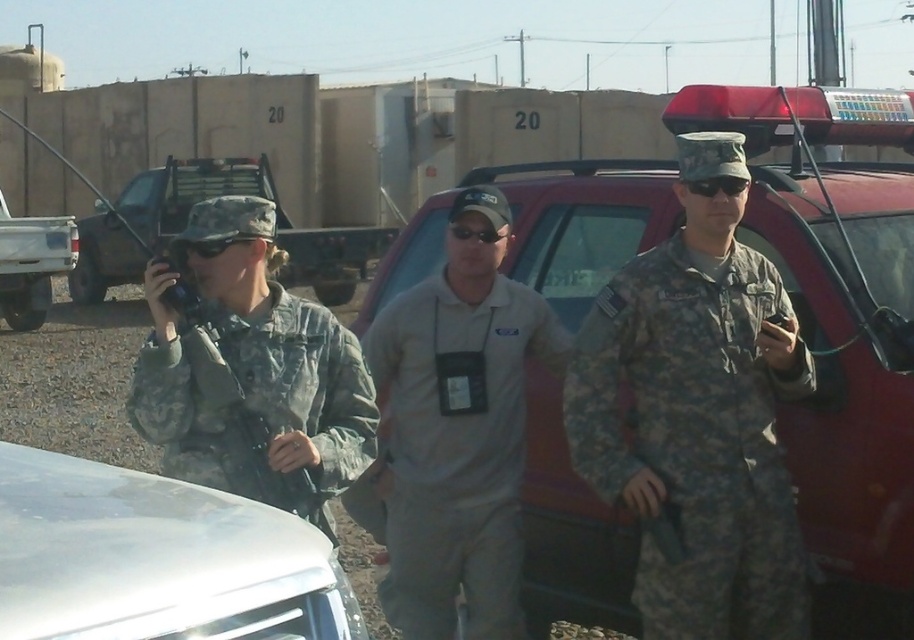
Question: Which of the following is the farthest from the observer?

Choices:
 (A) (198, 486)
 (B) (282, 400)

Answer: (B)

Question: Does matte red truck at center have a larger size compared to white glossy car at lower left?

Choices:
 (A) no
 (B) yes

Answer: (B)

Question: Which object is closer to the camera taking this photo?

Choices:
 (A) gray fabric shirt at center
 (B) metallic silver truck at left
 (C) white glossy car at lower left
 (D) camouflage fabric uniform at left

Answer: (C)

Question: Among these objects, which one is farthest from the camera?

Choices:
 (A) metallic silver truck at left
 (B) gray fabric shirt at center
 (C) camouflage fabric uniform at right

Answer: (A)

Question: Does matte red truck at center appear on the right side of camouflage fabric uniform at right?

Choices:
 (A) yes
 (B) no

Answer: (B)

Question: Does camouflage fabric uniform at right appear under camouflage fabric uniform at left?

Choices:
 (A) yes
 (B) no

Answer: (A)